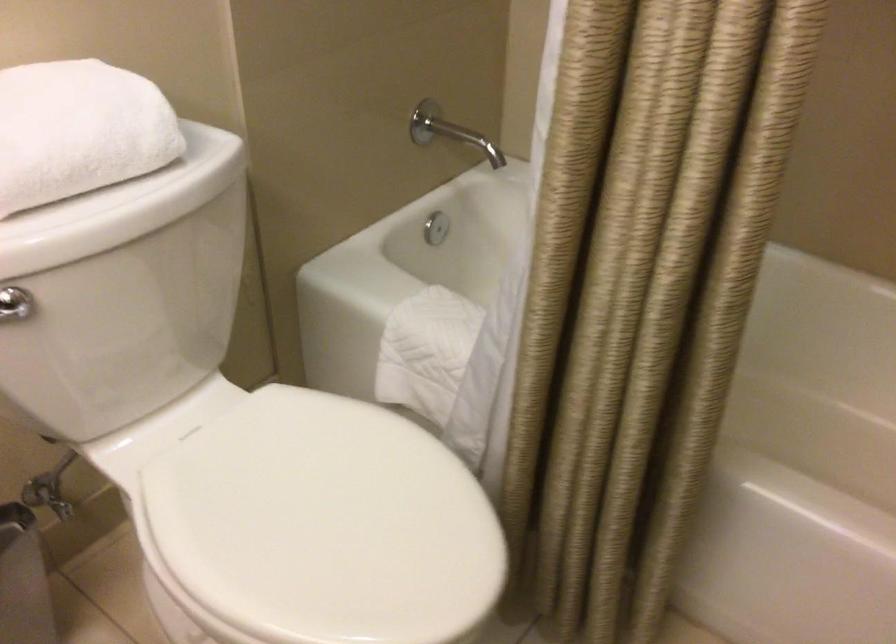
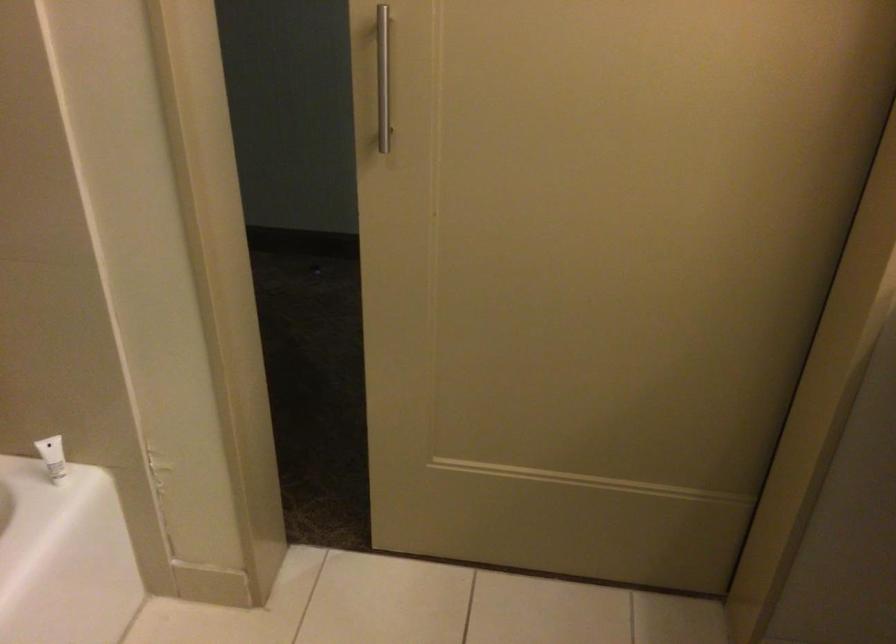
How did the camera likely rotate?

The rotation direction of the camera is right-down.